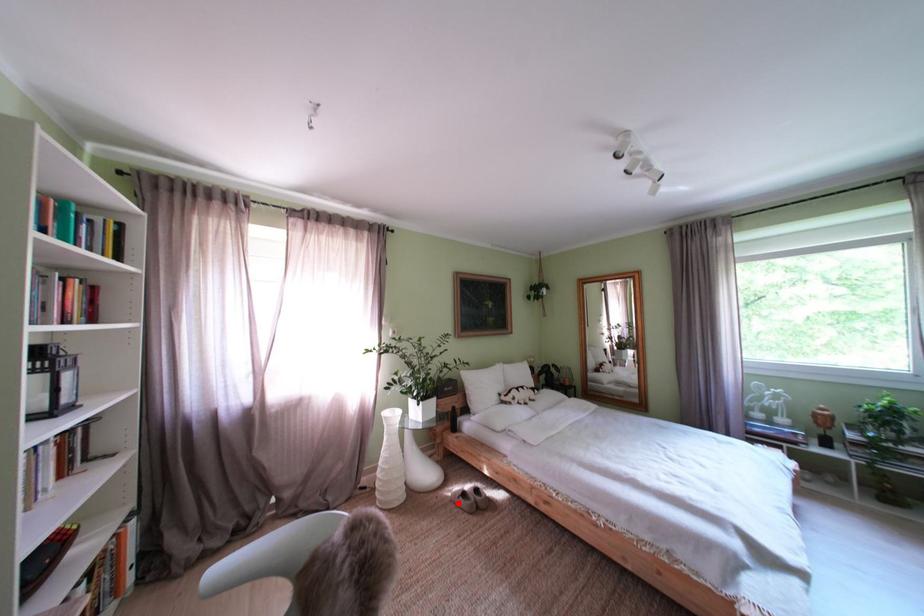
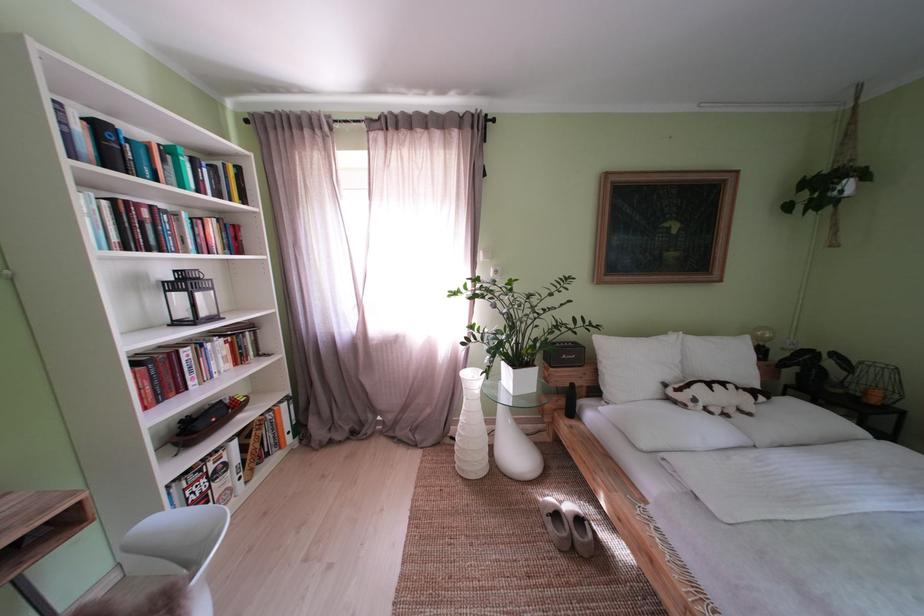
In the second image, find the point that corresponds to the highlighted location in the first image.

(546, 506)